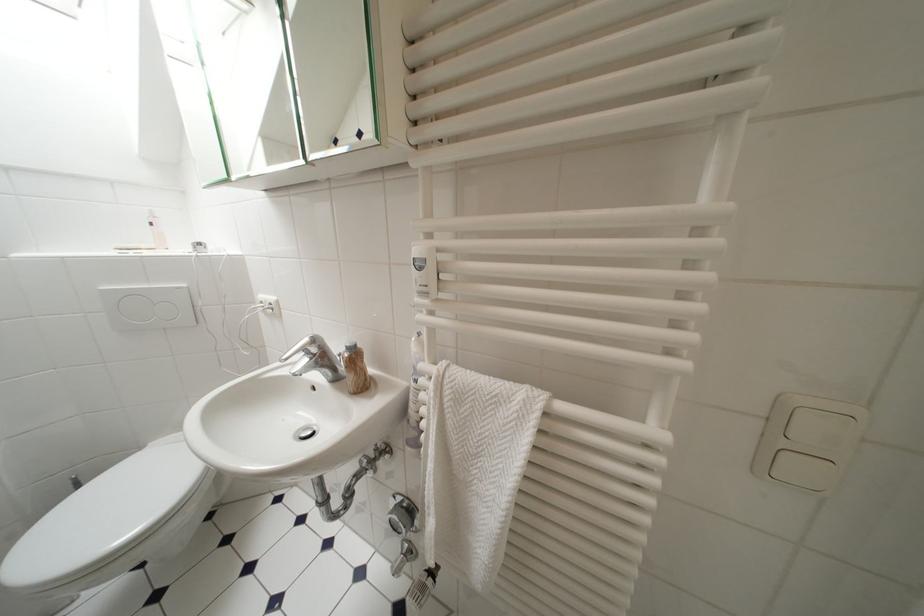
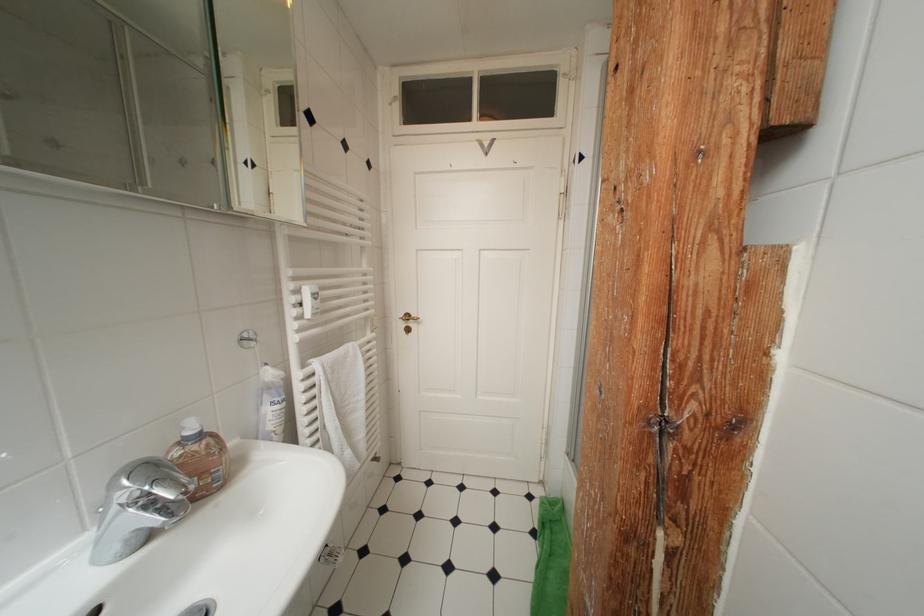
Question: Based on the continuous images, in which direction is the camera rotating? Reply with the corresponding letter.

Choices:
 (A) Left
 (B) Right
 (C) Up
 (D) Down

Answer: (B)